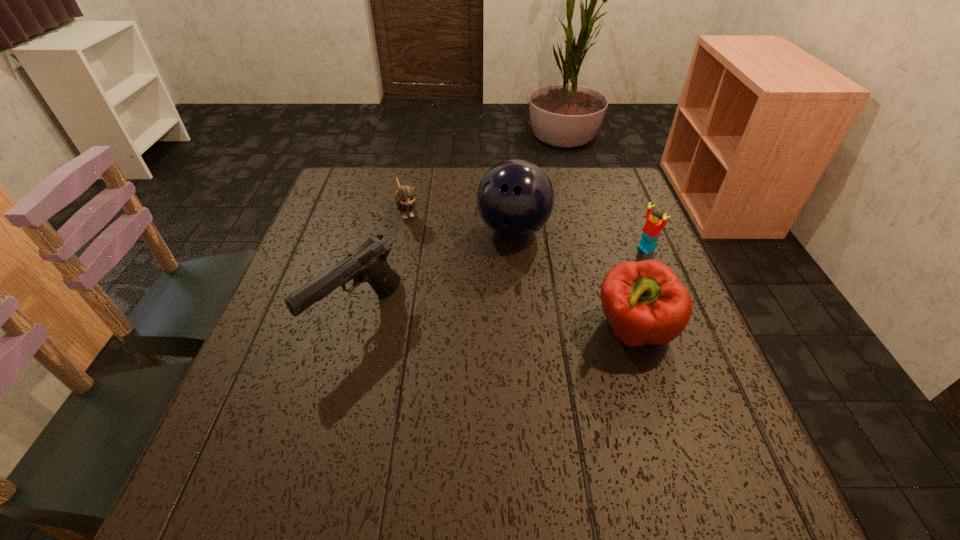
Locate an element on the screen. free spot between the gun and the bell pepper is located at coordinates (495, 323).

Find the location of a particular element. The image size is (960, 540). free space between the Lego and the gun is located at coordinates (501, 282).

Identify the location of vacant region between the bell pepper and the bowling ball. Image resolution: width=960 pixels, height=540 pixels. (573, 280).

The height and width of the screenshot is (540, 960). In order to click on free space between the Lego and the gun in this screenshot , I will do `click(501, 282)`.

Where is `free spot between the kitten and the bell pepper`? This screenshot has width=960, height=540. free spot between the kitten and the bell pepper is located at coordinates (520, 271).

This screenshot has width=960, height=540. Find the location of `free area in between the gun and the Lego`. free area in between the gun and the Lego is located at coordinates (501, 282).

Find the location of `vacant space in between the Lego and the third object from left to right`. vacant space in between the Lego and the third object from left to right is located at coordinates (580, 240).

Identify which object is the third nearest to the bowling ball. Please provide its 2D coordinates. Your answer should be formatted as a tuple, i.e. [(x, y)], where the tuple contains the x and y coordinates of a point satisfying the conditions above.

[(367, 263)]

Point out which object is positioned as the third nearest to the bell pepper. Please provide its 2D coordinates. Your answer should be formatted as a tuple, i.e. [(x, y)], where the tuple contains the x and y coordinates of a point satisfying the conditions above.

[(367, 263)]

You are a GUI agent. You are given a task and a screenshot of the screen. Output one action in this format:
    pyautogui.click(x=<x>, y=<y>)
    Task: Click on the vacant space that satisfies the following two spatial constraints: 1. on the front side of the kitten; 2. on the right side of the bowling ball
    
    Given the screenshot: What is the action you would take?
    pyautogui.click(x=404, y=230)